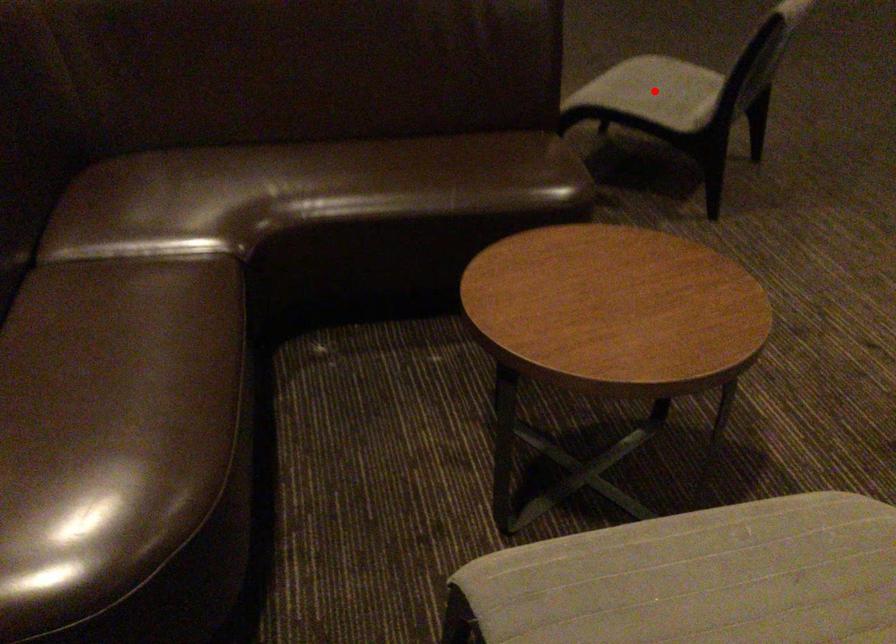
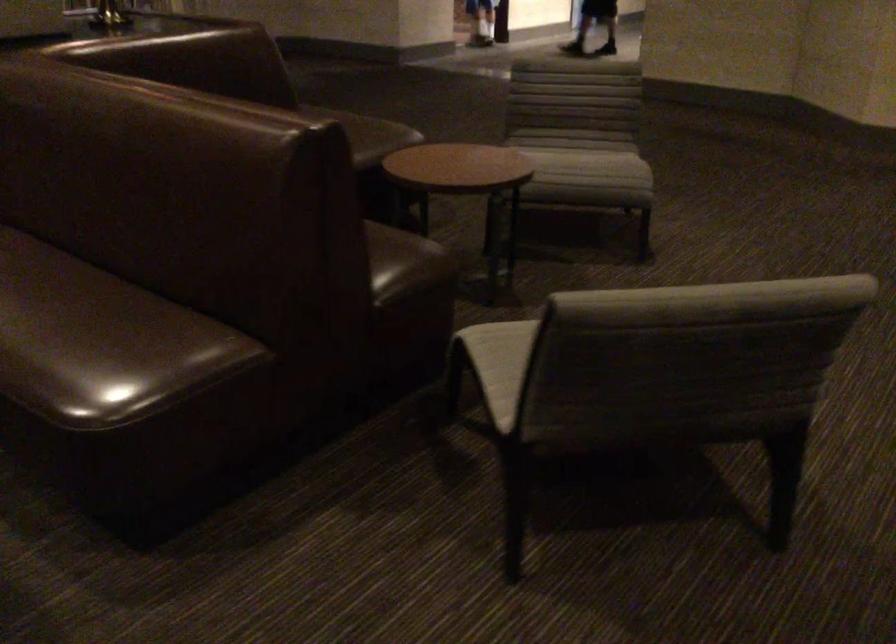
Question: I am providing you with two images of the same scene from different viewpoints. A red point is marked on the first image. Can you still see the location of the red point in image 2?

Choices:
 (A) Yes
 (B) No

Answer: (B)